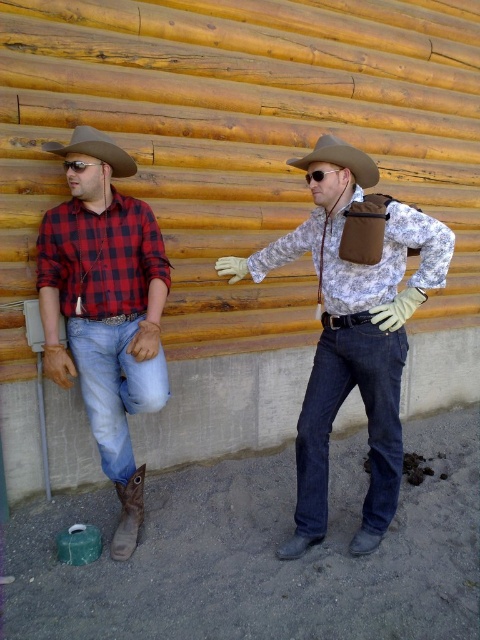
Question: Which is nearer to the floral-patterned fabric shirt at center?

Choices:
 (A) matte plaid shirt at left
 (B) camouflage fabric shirt at center

Answer: (B)

Question: Can you confirm if dark blue denim jeans at center is positioned above camouflage fabric shirt at center?

Choices:
 (A) yes
 (B) no

Answer: (B)

Question: Which point is closer to the camera?

Choices:
 (A) blue denim jeans at lower left
 (B) matte black goggles at upper left
 (C) brown leather cowboy boot at lower left
 (D) matte plaid shirt at left

Answer: (D)

Question: Can you confirm if matte plaid shirt at left is thinner than red plaid shirt at left?

Choices:
 (A) yes
 (B) no

Answer: (B)

Question: Is brown leather cowboy boot at lower left positioned in front of matte black goggles at upper left?

Choices:
 (A) no
 (B) yes

Answer: (A)

Question: Which is farther from the dark blue denim jeans at center?

Choices:
 (A) matte black goggles at upper left
 (B) brown leather cowboy hat at upper center
 (C) red plaid shirt at left

Answer: (A)